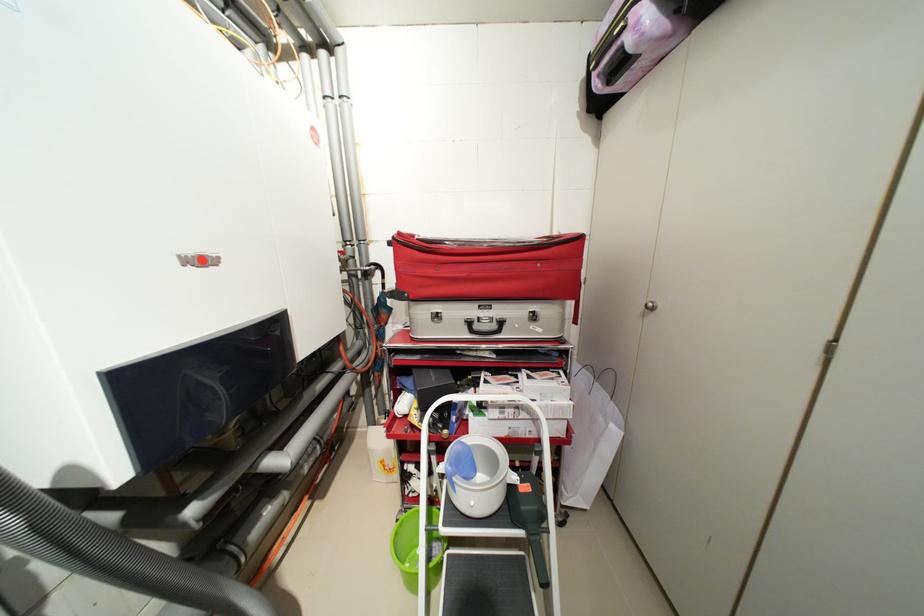
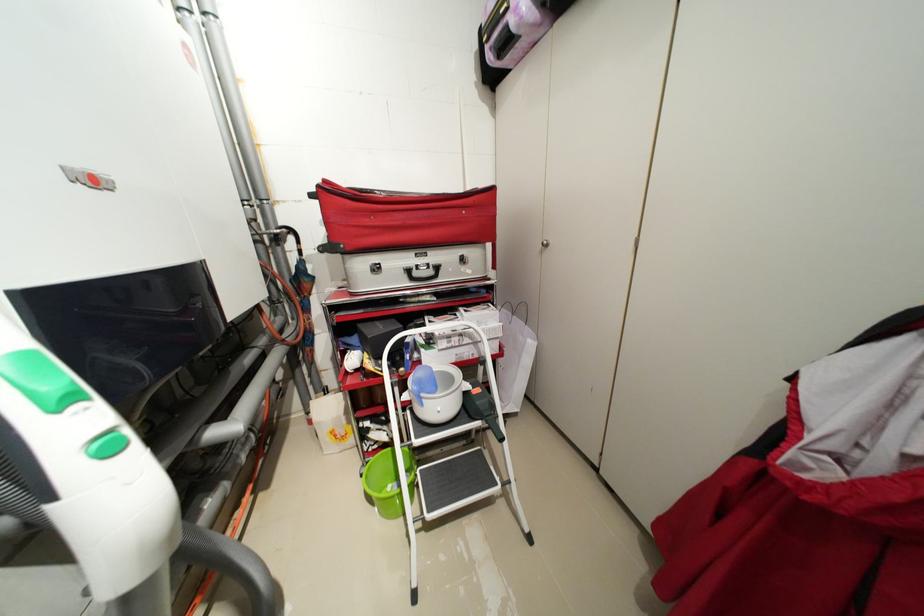
Question: The images are taken continuously from a first-person perspective. In which direction is your viewpoint rotating?

Choices:
 (A) Left
 (B) Right
 (C) Up
 (D) Down

Answer: (B)